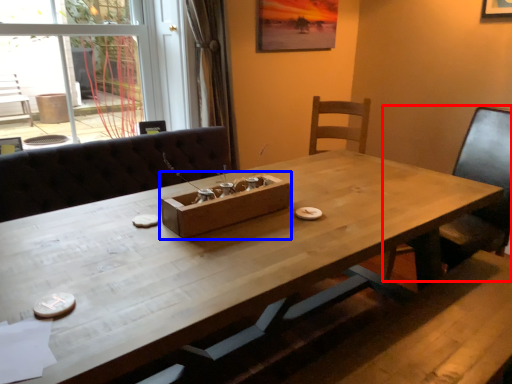
Question: Which object appears closest to the camera in this image, chair (highlighted by a red box) or cardboard box (highlighted by a blue box)?

Choices:
 (A) chair
 (B) cardboard box

Answer: (B)